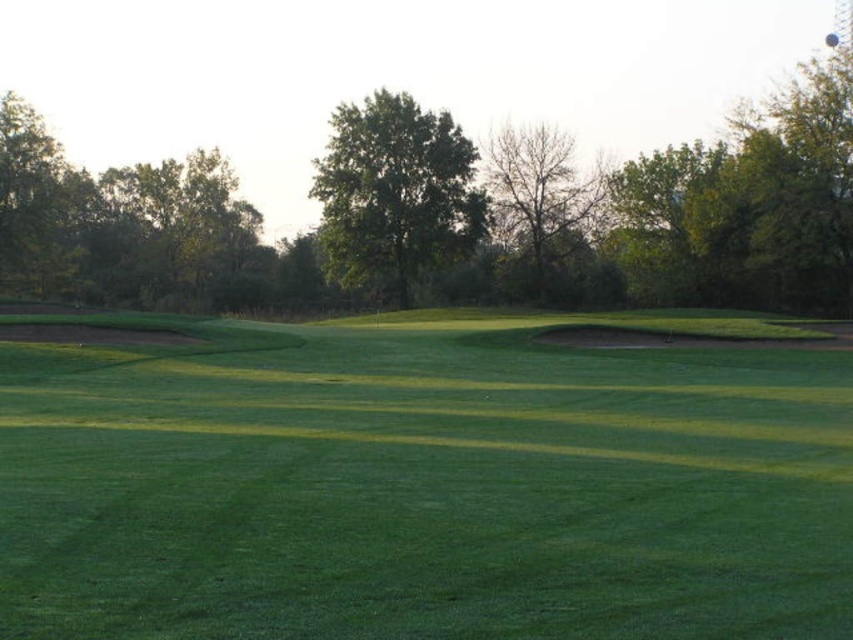
Question: Considering the real-world distances, which object is farthest from the green leafy tree at upper center?

Choices:
 (A) green grassy field at center
 (B) green leafy tree at center

Answer: (A)

Question: Which of the following is the farthest from the observer?

Choices:
 (A) green leafy tree at center
 (B) green leafy tree at upper center
 (C) green grassy field at center
 (D) bare branches at center

Answer: (D)

Question: Considering the relative positions of green leafy tree at center and bare branches at center in the image provided, where is green leafy tree at center located with respect to bare branches at center?

Choices:
 (A) right
 (B) left

Answer: (B)

Question: From the image, what is the correct spatial relationship of green grassy field at center in relation to bare branches at center?

Choices:
 (A) below
 (B) above

Answer: (A)

Question: Which is farther from the bare branches at center?

Choices:
 (A) green grassy field at center
 (B) green leafy tree at upper center

Answer: (A)

Question: Does green leafy tree at upper center have a larger size compared to green leafy tree at center?

Choices:
 (A) no
 (B) yes

Answer: (B)